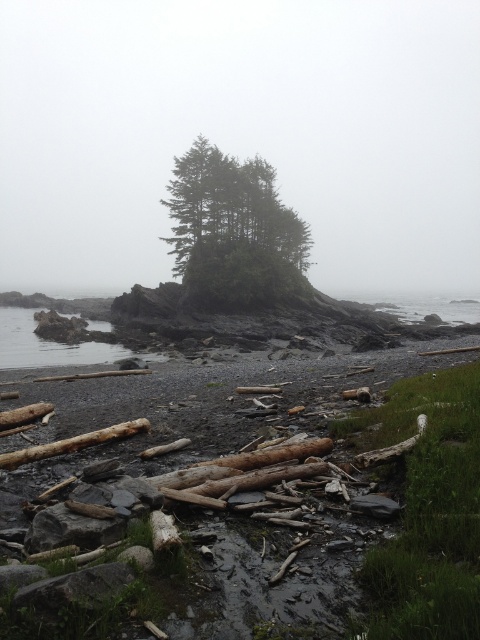
Does dark brown driftwood at center have a greater width compared to clear water at lower left?

No.

Where is `dark brown driftwood at center`? This screenshot has width=480, height=640. dark brown driftwood at center is located at coordinates (252, 438).

Locate an element on the screen. This screenshot has height=640, width=480. dark brown driftwood at center is located at coordinates (252, 438).

Who is shorter, green matte tree at center or brown rough log at lower left?

With less height is brown rough log at lower left.

Is green matte tree at center bigger than brown rough log at lower left?

Yes, green matte tree at center is bigger than brown rough log at lower left.

Which is in front, point (197, 237) or point (67, 444)?

Point (67, 444) is more forward.

Find the location of `green matte tree at center`. green matte tree at center is located at coordinates (233, 232).

Does dark brown driftwood at center appear over brown rough log at lower left?

Correct, dark brown driftwood at center is located above brown rough log at lower left.

Does dark brown driftwood at center appear under brown rough log at lower left?

Incorrect, dark brown driftwood at center is not positioned below brown rough log at lower left.

Which is in front, point (420, 467) or point (75, 438)?

Point (420, 467) is in front.

Identify the location of dark brown driftwood at center. Image resolution: width=480 pixels, height=640 pixels. (252, 438).